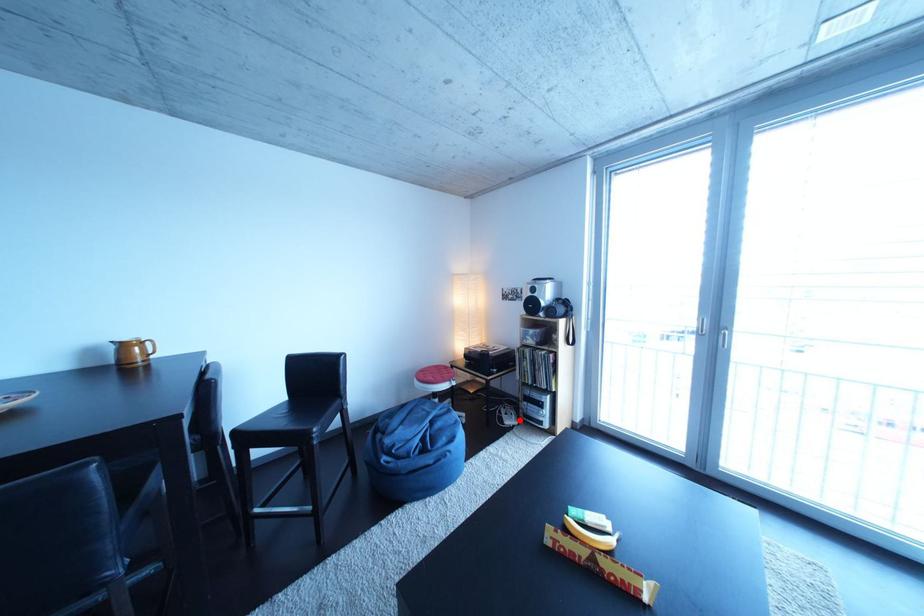
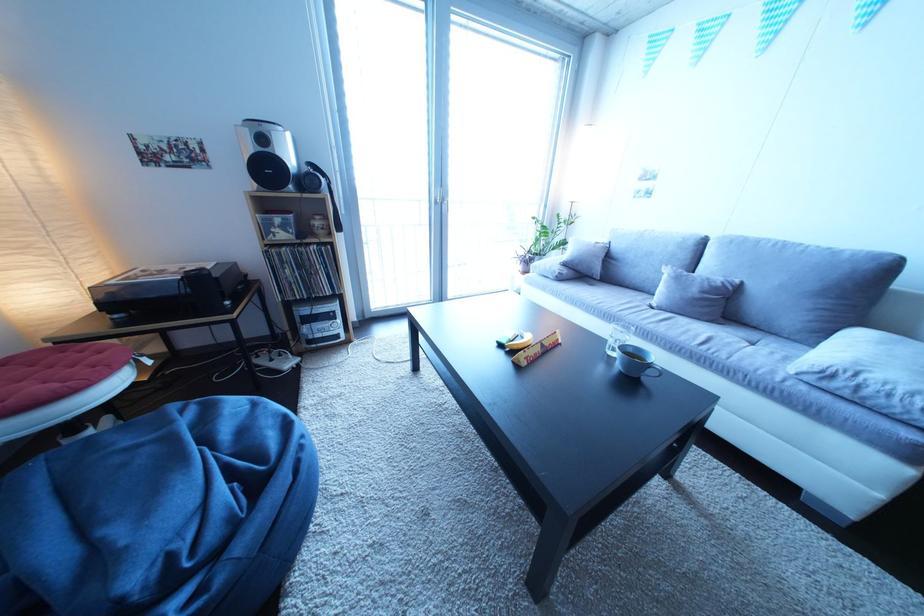
Find the pixel in the second image that matches the highlighted location in the first image.

(285, 366)